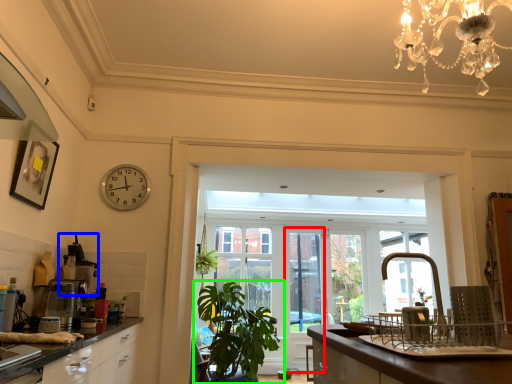
Question: Which is farther away from screen door (highlighted by a red box)? appliance (highlighted by a blue box) or houseplant (highlighted by a green box)?

Choices:
 (A) appliance
 (B) houseplant

Answer: (A)